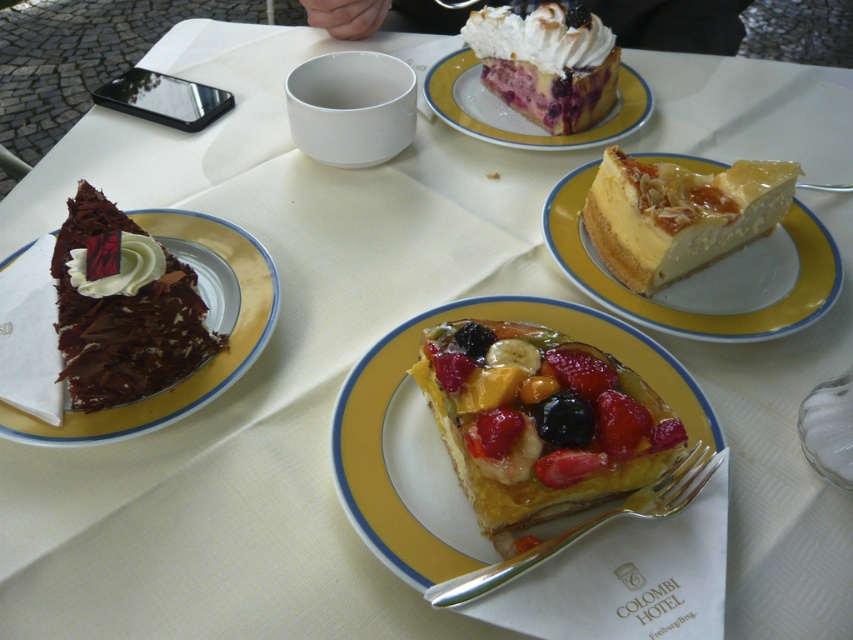
Question: Which object is closer to the camera taking this photo?

Choices:
 (A) smooth white cheesecake at right
 (B) yellow glazed plate at upper center
 (C) silver metallic fork at lower center

Answer: (C)

Question: Which point is closer to the camera taking this photo?

Choices:
 (A) (515, 97)
 (B) (811, 307)

Answer: (B)

Question: Does whipped cream topped pie at upper center have a greater width compared to silver metallic fork at lower center?

Choices:
 (A) no
 (B) yes

Answer: (A)

Question: Where is glossy fruit-topped tart at center located in relation to smooth white cheesecake at right in the image?

Choices:
 (A) above
 (B) below

Answer: (B)

Question: Is smooth chocolate cake at left in front of yellow glazed plate at upper center?

Choices:
 (A) yes
 (B) no

Answer: (A)

Question: Which object appears closest to the camera in this image?

Choices:
 (A) glossy fruit-topped tart at center
 (B) translucent yellow plate at center

Answer: (A)